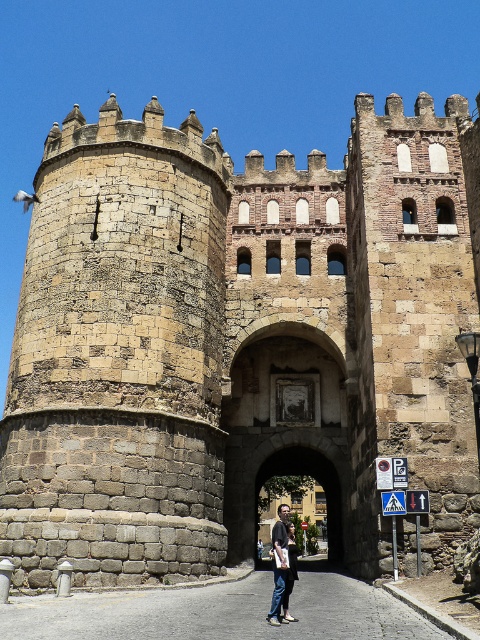
Which of these two, stone archway at center or dark gray fabric jacket at center, stands taller?

dark gray fabric jacket at center is taller.

Is stone archway at center positioned before dark gray fabric jacket at center?

No, it is behind dark gray fabric jacket at center.

Which is in front, point (275, 467) or point (275, 538)?

Positioned in front is point (275, 538).

You are a GUI agent. You are given a task and a screenshot of the screen. Output one action in this format:
    pyautogui.click(x=<x>, y=<y>)
    Task: Click on the stone archway at center
    
    Given the screenshot: What is the action you would take?
    pyautogui.click(x=316, y=480)